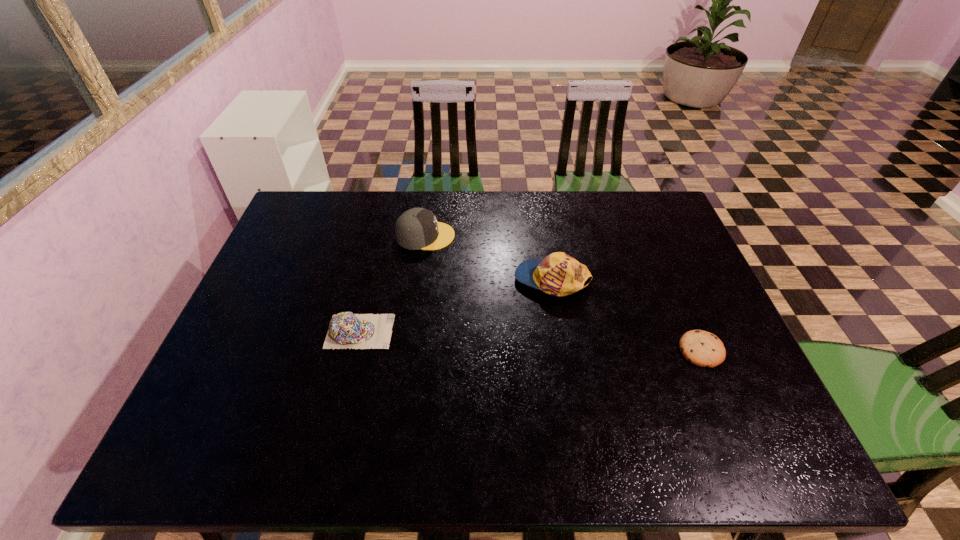
In order to click on free space at the far right corner of the desktop in this screenshot , I will do `click(621, 213)`.

Locate an element on the screen. free space that is in between the nearest cap and the farthest cap is located at coordinates (393, 284).

At what (x,y) coordinates should I click in order to perform the action: click on free space between the third object from left to right and the farthest object. Please return your answer as a coordinate pair (x, y). This screenshot has width=960, height=540. Looking at the image, I should click on (489, 258).

Image resolution: width=960 pixels, height=540 pixels. Find the location of `vacant region between the shortest cap and the rightmost cap`. vacant region between the shortest cap and the rightmost cap is located at coordinates (456, 306).

The width and height of the screenshot is (960, 540). I want to click on free space between the nearest cap and the third nearest object, so click(456, 306).

Locate an element on the screen. vacant space in between the shortest cap and the farthest cap is located at coordinates (393, 284).

Locate an element on the screen. free area in between the farthest cap and the third tallest object is located at coordinates (393, 284).

This screenshot has width=960, height=540. I want to click on free space between the second farthest object and the rightmost object, so click(x=627, y=315).

Where is `free space between the second shortest object and the shortest object`? free space between the second shortest object and the shortest object is located at coordinates (531, 341).

Find the location of a particular element. This screenshot has width=960, height=540. free space between the farthest object and the third tallest object is located at coordinates (393, 284).